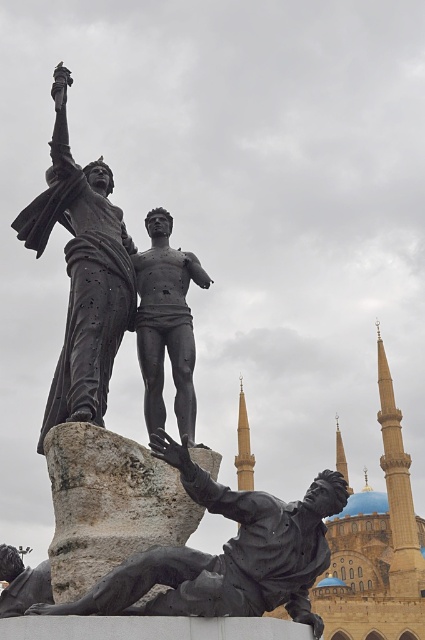
Question: Which point appears farthest from the camera in this image?

Choices:
 (A) (88, 561)
 (B) (173, 592)
 (C) (164, 342)
 (D) (48, 397)

Answer: (D)

Question: Is bronze statue at upper left to the left of gray stone statue at center from the viewer's perspective?

Choices:
 (A) yes
 (B) no

Answer: (A)

Question: Is bronze statue at upper left smaller than black polished statue at center?

Choices:
 (A) no
 (B) yes

Answer: (A)

Question: Estimate the real-world distances between objects in this image. Which object is farther from the bronze statue at upper left?

Choices:
 (A) bronze statue at lower center
 (B) black polished statue at center
 (C) gray stone statue at center

Answer: (A)

Question: Based on their relative distances, which object is nearer to the black polished statue at center?

Choices:
 (A) gray stone statue at center
 (B) bronze statue at upper left

Answer: (B)

Question: Does gray stone statue at center appear on the right side of black polished statue at center?

Choices:
 (A) no
 (B) yes

Answer: (A)